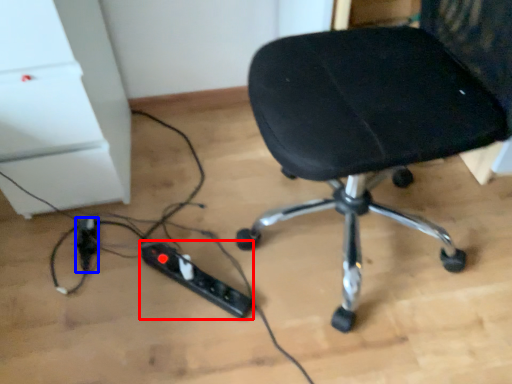
Question: Among these objects, which one is nearest to the camera, extension cord (highlighted by a red box) or extension cord (highlighted by a blue box)?

Choices:
 (A) extension cord
 (B) extension cord

Answer: (A)